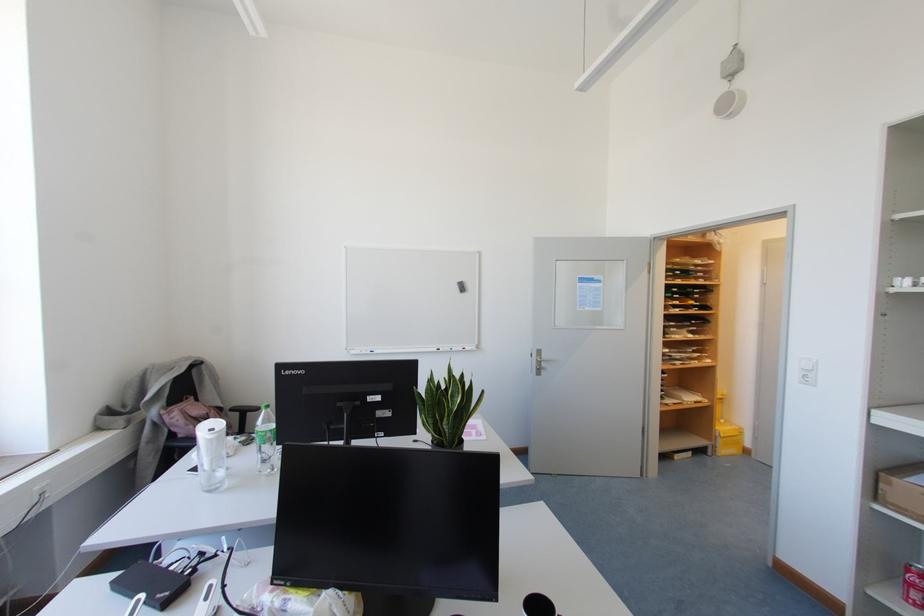
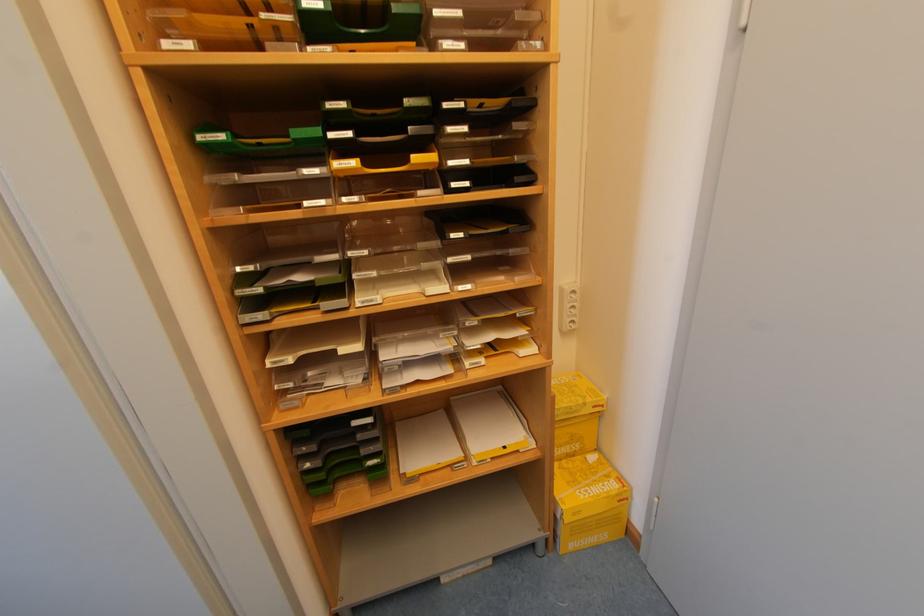
In a continuous first-person perspective shot, in which direction is the camera moving?

The cameraman moved toward right, forward.